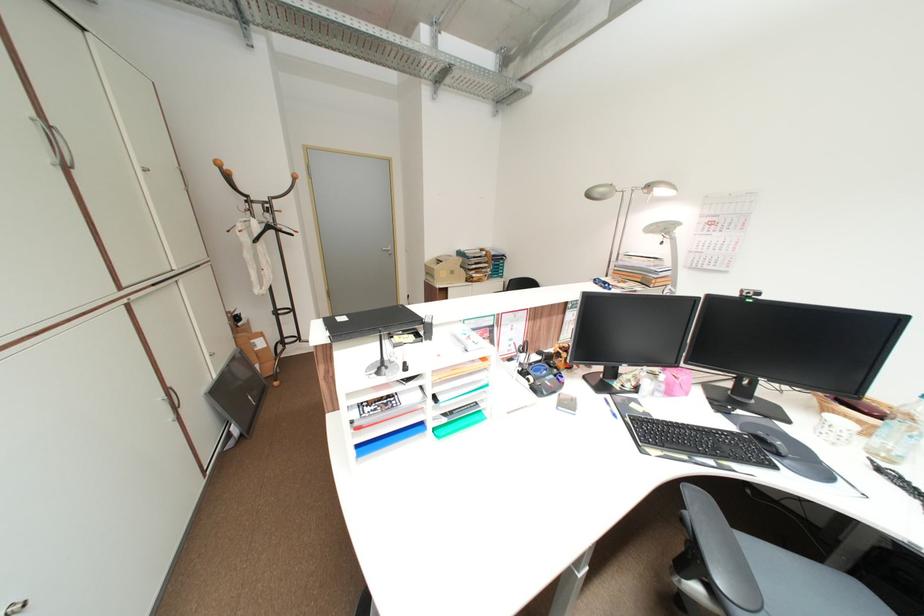
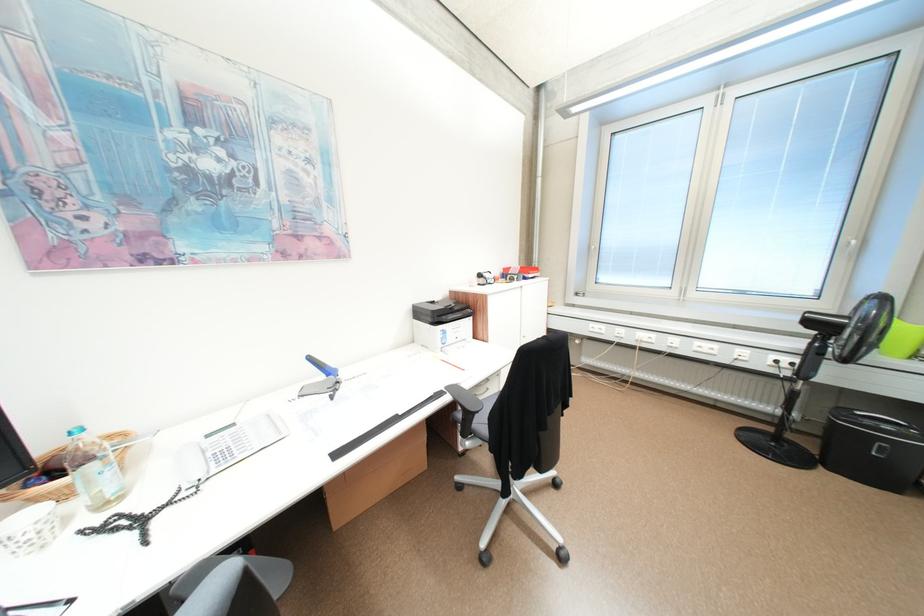
The point at (892, 432) is marked in the first image. Where is the corresponding point in the second image?

(91, 487)